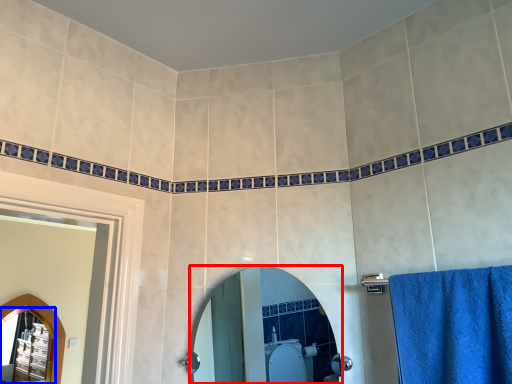
Question: Among these objects, which one is farthest to the camera, mirror (highlighted by a red box) or mirror (highlighted by a blue box)?

Choices:
 (A) mirror
 (B) mirror

Answer: (B)